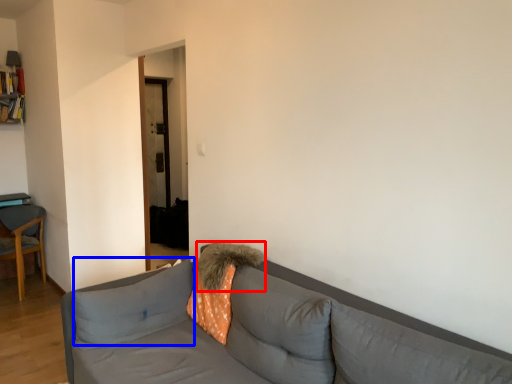
Question: Which object is further to the camera taking this photo, pillow (highlighted by a red box) or pillow (highlighted by a blue box)?

Choices:
 (A) pillow
 (B) pillow

Answer: (A)